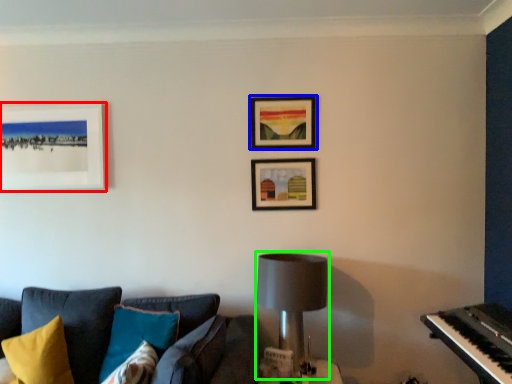
Question: Which is farther away from picture frame (highlighted by a red box)? picture frame (highlighted by a blue box) or table lamp (highlighted by a green box)?

Choices:
 (A) picture frame
 (B) table lamp

Answer: (B)